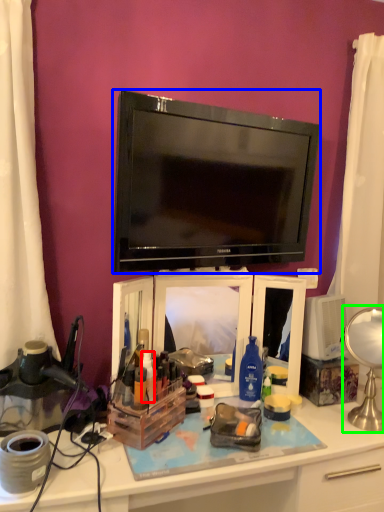
Question: Estimate the real-world distances between objects in this image. Which object is farther from toiletry (highlighted by a red box), television (highlighted by a blue box) or table lamp (highlighted by a green box)?

Choices:
 (A) television
 (B) table lamp

Answer: (B)